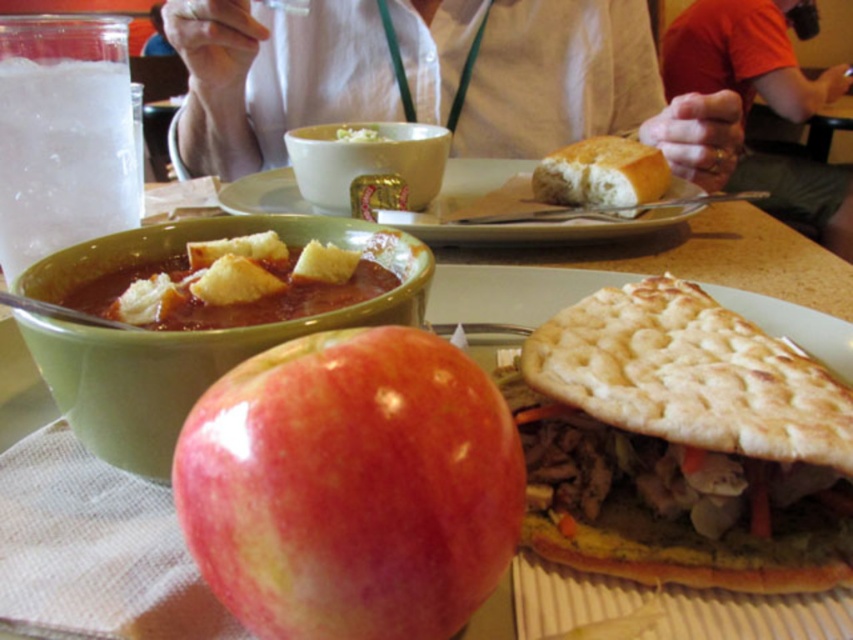
The image size is (853, 640). Describe the element at coordinates (589, 90) in the screenshot. I see `white fabric shirt at upper center` at that location.

I want to click on white fabric shirt at upper center, so click(589, 90).

Which is behind, point (364, 83) or point (419, 298)?

The point (364, 83) is behind.

Locate an element on the screen. The image size is (853, 640). white fabric shirt at upper center is located at coordinates (589, 90).

Can you confirm if red matte apple at center is thinner than white fabric shirt at upper center?

Correct, red matte apple at center's width is less than white fabric shirt at upper center's.

Locate an element on the screen. The width and height of the screenshot is (853, 640). red matte apple at center is located at coordinates (351, 486).

Which is in front, point (436, 512) or point (805, 77)?

Point (436, 512)

Does red matte apple at center appear over orange cotton shirt at upper right?

No, red matte apple at center is not above orange cotton shirt at upper right.

Does point (352, 349) come farther from viewer compared to point (801, 212)?

No, it is not.

Identify the location of red matte apple at center. (351, 486).